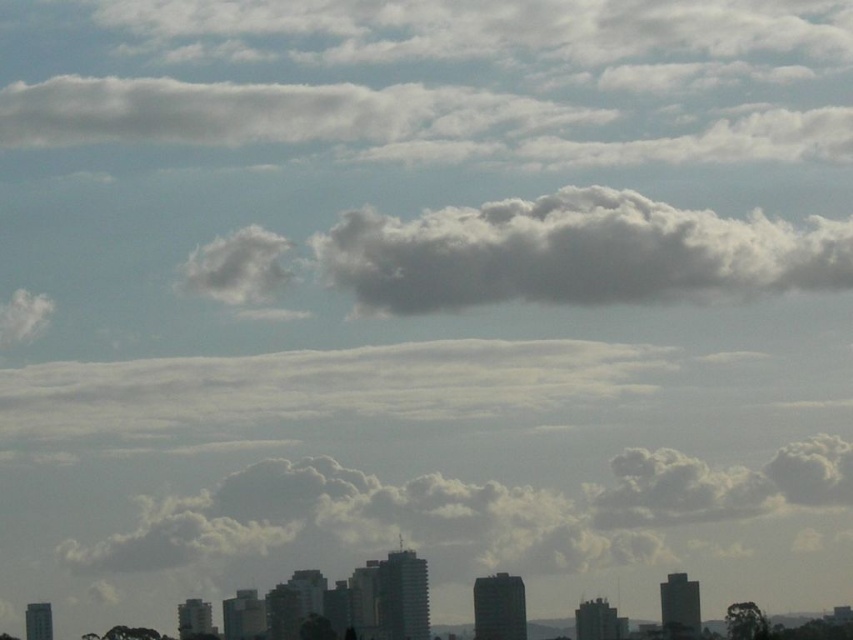
Is white fluffy cloud at center thinner than white fluffy cloud at upper center?

Indeed, white fluffy cloud at center has a lesser width compared to white fluffy cloud at upper center.

How much distance is there between white fluffy cloud at center and white fluffy cloud at upper center?

white fluffy cloud at center is 127.93 feet away from white fluffy cloud at upper center.

Does point (637, 205) come in front of point (259, 131)?

Yes, it is.

Where is `white fluffy cloud at center`? The width and height of the screenshot is (853, 640). white fluffy cloud at center is located at coordinates (576, 253).

Which is more to the right, white fluffy cloud at center or white fluffy cloud at upper left?

white fluffy cloud at center is more to the right.

Is point (376, 266) less distant than point (15, 320)?

Yes, point (376, 266) is closer to viewer.

Find the location of a particular element. This screenshot has height=640, width=853. white fluffy cloud at center is located at coordinates (576, 253).

Is the position of white fluffy cloud at upper center less distant than that of white fluffy cloud at upper left?

That is True.

Does white fluffy cloud at upper center have a lesser height compared to white fluffy cloud at upper left?

No, white fluffy cloud at upper center is not shorter than white fluffy cloud at upper left.

This screenshot has height=640, width=853. What do you see at coordinates (265, 113) in the screenshot? I see `white fluffy cloud at upper center` at bounding box center [265, 113].

Where is `white fluffy cloud at upper center`? white fluffy cloud at upper center is located at coordinates (265, 113).